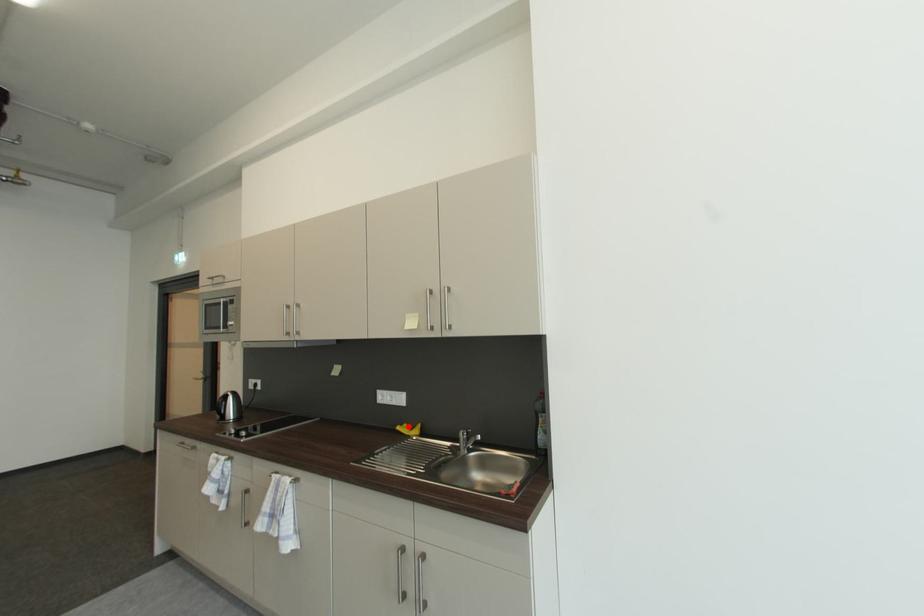
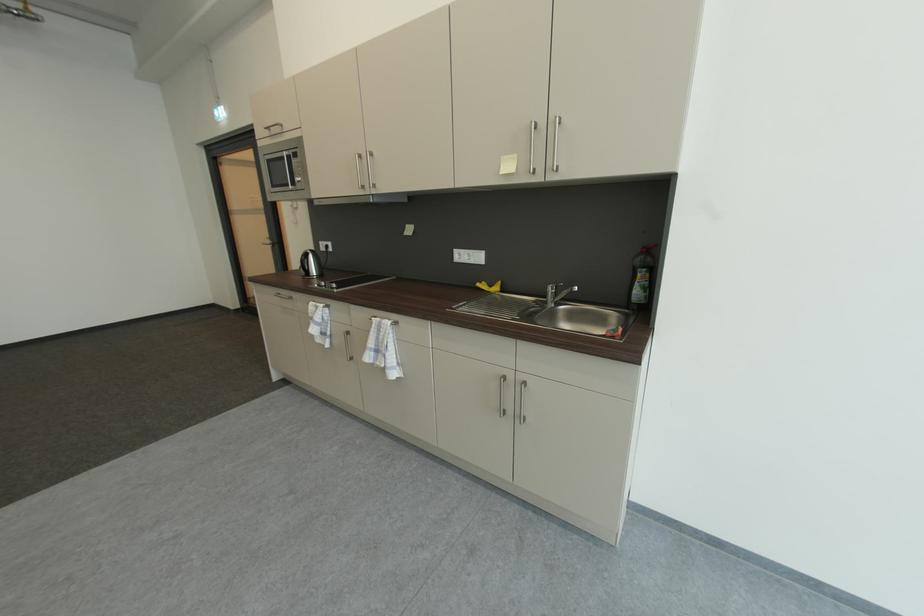
Where in the second image is the point corresponding to the highlighted location from the first image?

(487, 284)